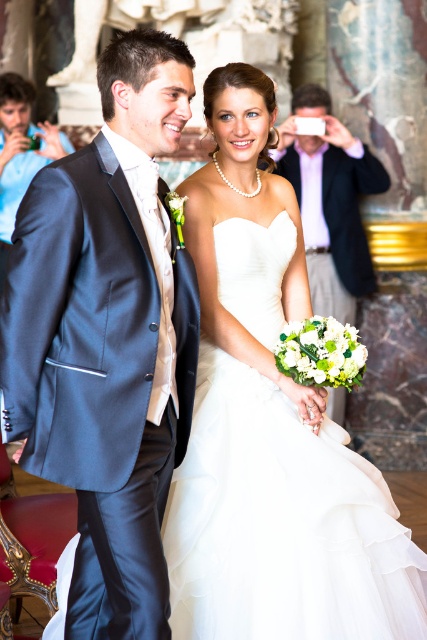
Question: Which object is closer to the camera taking this photo?

Choices:
 (A) satin navy suit at left
 (B) satin blue suit at left

Answer: (A)

Question: Does white tulle dress at center appear on the right side of satin blue suit at left?

Choices:
 (A) no
 (B) yes

Answer: (B)

Question: Is white tulle dress at center further to the viewer compared to satin blue suit at left?

Choices:
 (A) no
 (B) yes

Answer: (A)

Question: Does satin navy suit at left have a lesser width compared to white tulle dress at center?

Choices:
 (A) yes
 (B) no

Answer: (A)

Question: Among these objects, which one is farthest from the camera?

Choices:
 (A) matte white shirt at upper center
 (B) satin blue suit at left
 (C) white tulle dress at center

Answer: (B)

Question: Considering the real-world distances, which object is closest to the satin navy suit at left?

Choices:
 (A) satin blue suit at left
 (B) matte white shirt at upper center
 (C) white tulle dress at center

Answer: (C)